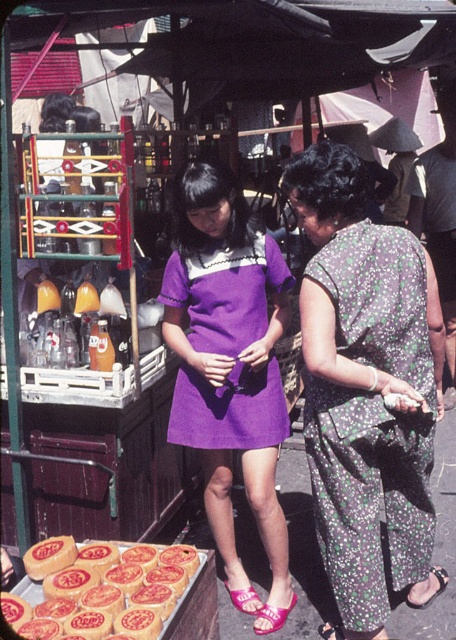
The height and width of the screenshot is (640, 456). What do you see at coordinates (271, 616) in the screenshot?
I see `pink fabric sandal at lower center` at bounding box center [271, 616].

Is point (283, 618) positioned after point (442, 577)?

No, it is in front of (442, 577).

This screenshot has width=456, height=640. I want to click on pink fabric sandal at lower center, so click(x=271, y=616).

Is point (397, 307) in front of point (263, 413)?

Yes, point (397, 307) is in front of point (263, 413).

Can you confirm if floral-patterned dress at center is wider than purple cotton dress at center?

Correct, the width of floral-patterned dress at center exceeds that of purple cotton dress at center.

Between point (314, 172) and point (253, 285), which one is positioned in front?

Point (314, 172)

Image resolution: width=456 pixels, height=640 pixels. Find the location of `floral-patterned dress at center`. floral-patterned dress at center is located at coordinates (366, 388).

Is purple fabric dress at center taller than pink fabric sandal at lower center?

Indeed, purple fabric dress at center has a greater height compared to pink fabric sandal at lower center.

Is purple fabric dress at center further to the viewer compared to pink fabric sandal at lower center?

No, purple fabric dress at center is in front of pink fabric sandal at lower center.

Is point (281, 433) positioned before point (267, 612)?

Yes, point (281, 433) is in front of point (267, 612).

Find the location of a particular element. purple fabric dress at center is located at coordinates (228, 364).